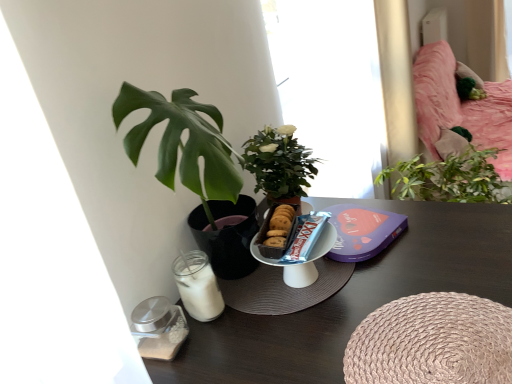
Question: Is point (509, 167) closer or farther from the camera than point (374, 372)?

Choices:
 (A) closer
 (B) farther

Answer: (B)

Question: From the image's perspective, relative to woven beige placemat at lower right, is pink fabric bed at upper right above or below?

Choices:
 (A) below
 (B) above

Answer: (B)

Question: Based on their relative distances, which object is farther from the transparent glass window at center?

Choices:
 (A) pink fabric bed at upper right
 (B) woven beige placemat at lower right
 (C) blue foil chocolate bar at center
 (D) wooden table at lower left

Answer: (B)

Question: Estimate the real-world distances between objects in this image. Which object is farther from the blue foil chocolate bar at center?

Choices:
 (A) wooden table at lower left
 (B) pink fabric bed at upper right
 (C) transparent glass window at center
 (D) woven beige placemat at lower right

Answer: (B)